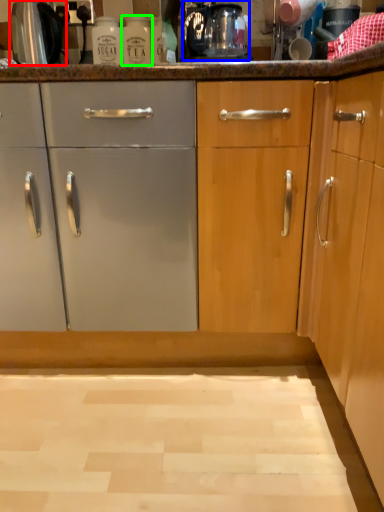
Question: Which object is the farthest from appliance (highlighted by a red box)? Choose among these: coffee machine (highlighted by a blue box) or bottle (highlighted by a green box).

Choices:
 (A) coffee machine
 (B) bottle

Answer: (A)